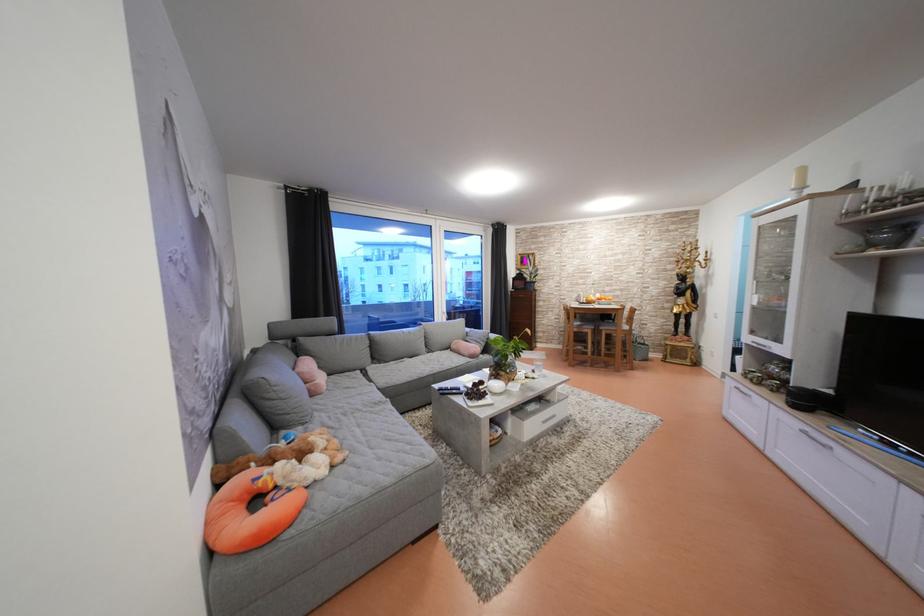
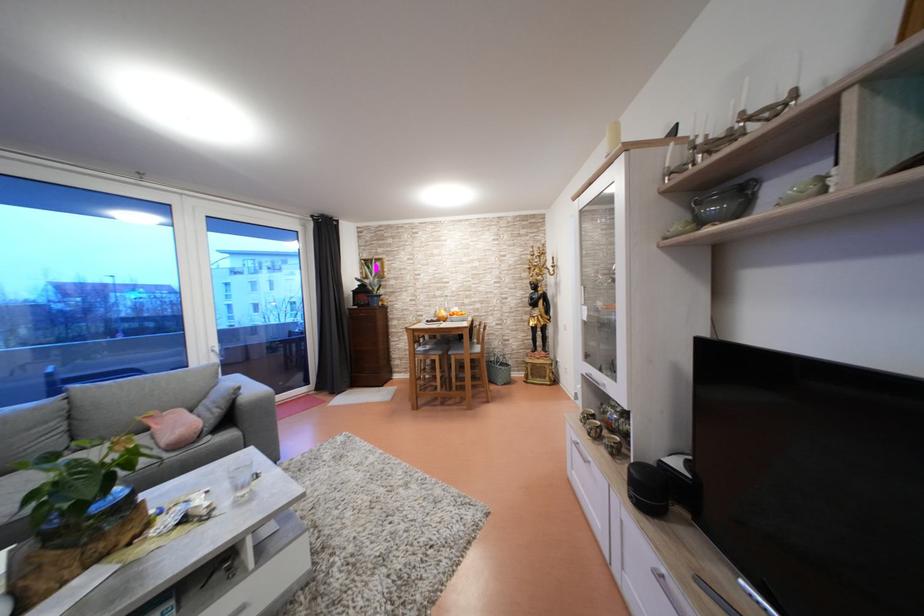
What movement of the cameraman would produce the second image?

The movement direction of the cameraman is right, forward.